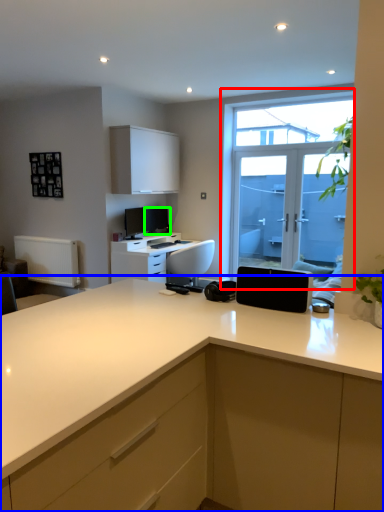
Question: Considering the real-world distances, which object is farthest from window (highlighted by a red box)? countertop (highlighted by a blue box) or computer monitor (highlighted by a green box)?

Choices:
 (A) countertop
 (B) computer monitor

Answer: (A)